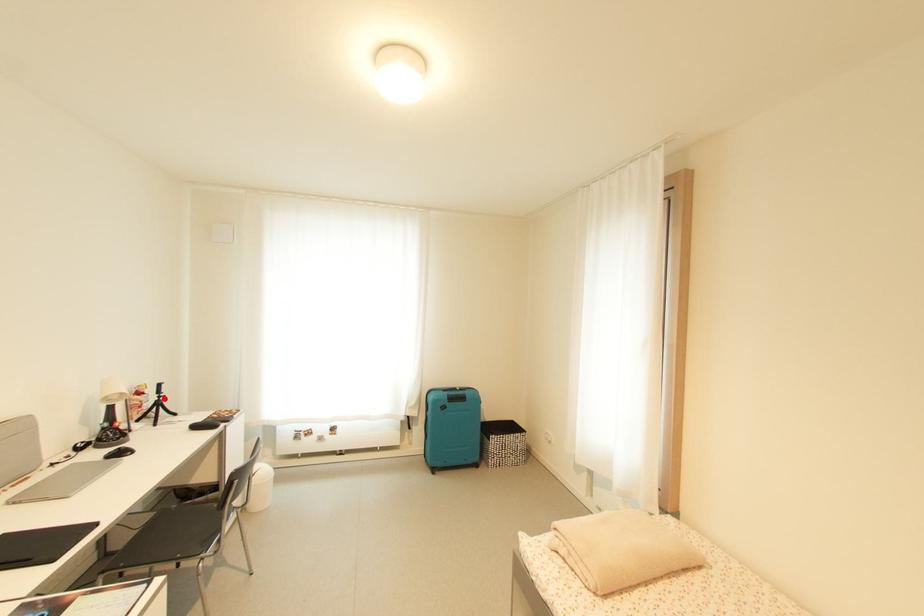
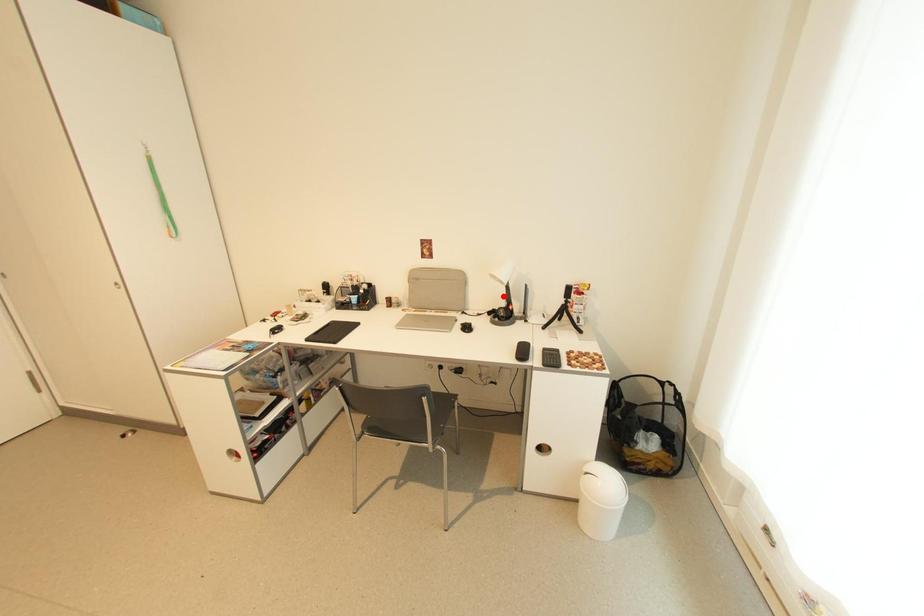
I am providing you with two images of the same scene from different viewpoints. A red point is marked on the first image and another point is marked on the second image. Is the marked point in image1 the same physical position as the marked point in image2?

No